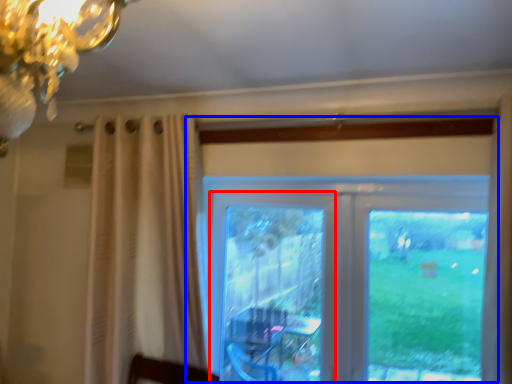
Question: Which object appears farthest to the camera in this image, screen door (highlighted by a red box) or window (highlighted by a blue box)?

Choices:
 (A) screen door
 (B) window

Answer: (A)